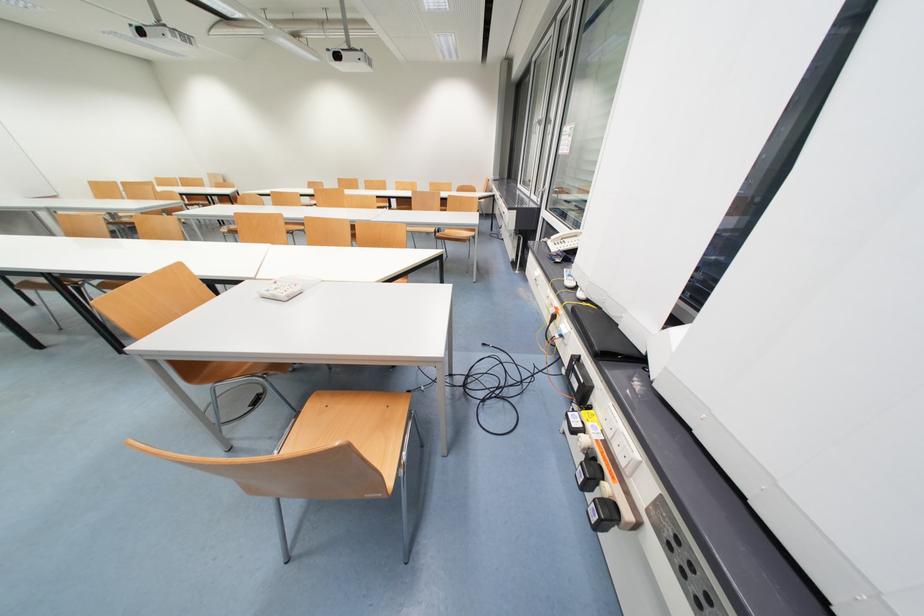
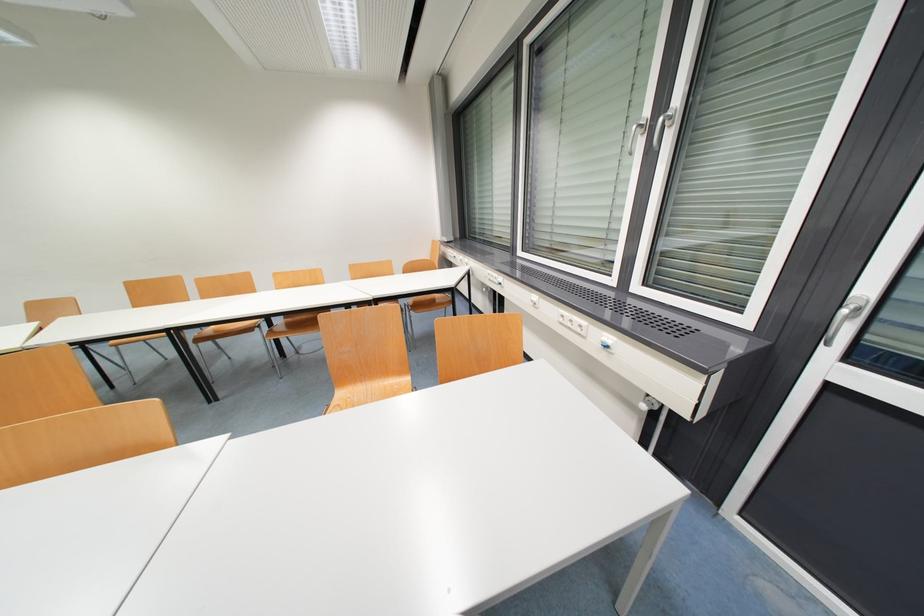
Question: In a continuous first-person perspective shot, in which direction is the camera moving?

Choices:
 (A) Left
 (B) Right
 (C) Forward
 (D) Backward

Answer: (C)